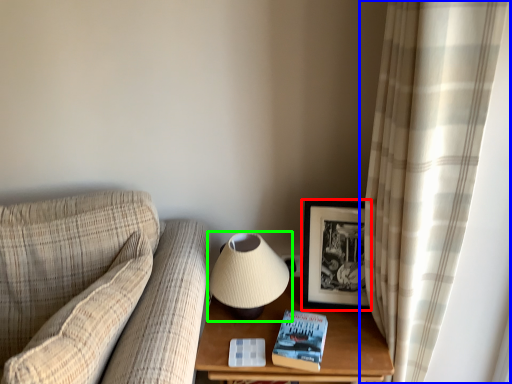
Question: Which object is positioned closest to picture frame (highlighted by a red box)? Select from curtain (highlighted by a blue box) and lamp (highlighted by a green box).

Choices:
 (A) curtain
 (B) lamp

Answer: (B)